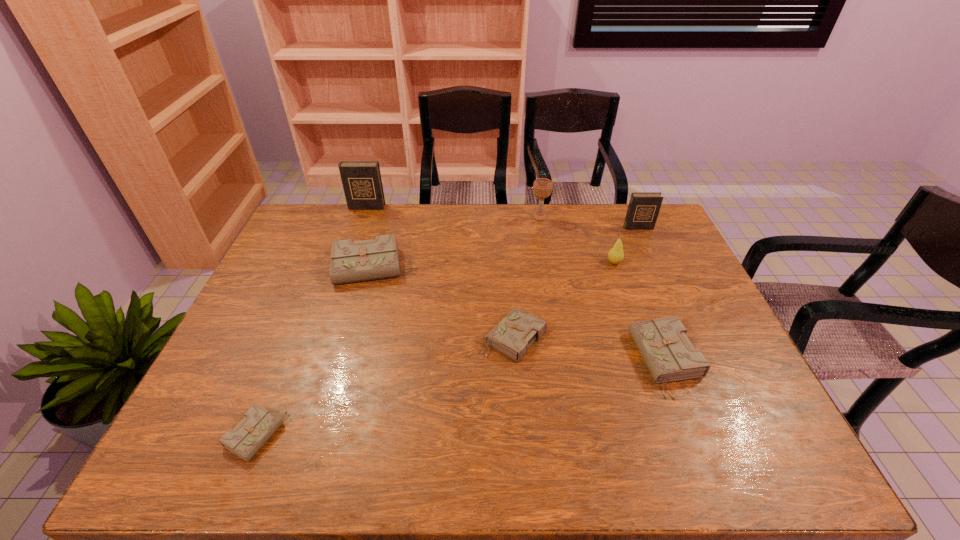
You are a GUI agent. You are given a task and a screenshot of the screen. Output one action in this format:
    pyautogui.click(x=<x>, y=<y>)
    Task: Click on the free space located on the back of the third shortest object
    
    Given the screenshot: What is the action you would take?
    pyautogui.click(x=634, y=278)

Find the location of a particular element. The height and width of the screenshot is (540, 960). blank space located on the left of the second green diary from right to left is located at coordinates (440, 338).

This screenshot has height=540, width=960. I want to click on free region located on the left of the smallest green diary, so click(x=197, y=435).

Identify the location of chalice that is at the far edge. This screenshot has width=960, height=540. (542, 187).

Locate an element on the screen. The image size is (960, 540). object that is at the near edge is located at coordinates (251, 433).

This screenshot has height=540, width=960. I want to click on object at the left edge, so click(251, 433).

Image resolution: width=960 pixels, height=540 pixels. Identify the location of object that is at the near left corner. point(251,433).

At what (x,y) coordinates should I click in order to perform the action: click on object at the far right corner. Please return your answer as a coordinate pair (x, y). The image size is (960, 540). Looking at the image, I should click on (643, 209).

This screenshot has width=960, height=540. In order to click on vacant area at the far edge in this screenshot , I will do `click(374, 225)`.

Identify the location of vacant space at the near edge. The height and width of the screenshot is (540, 960). (284, 446).